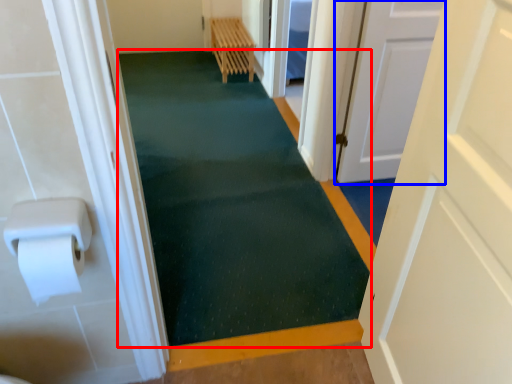
Question: Which of the following is the farthest to the observer, bath mat (highlighted by a red box) or door (highlighted by a blue box)?

Choices:
 (A) bath mat
 (B) door

Answer: (B)